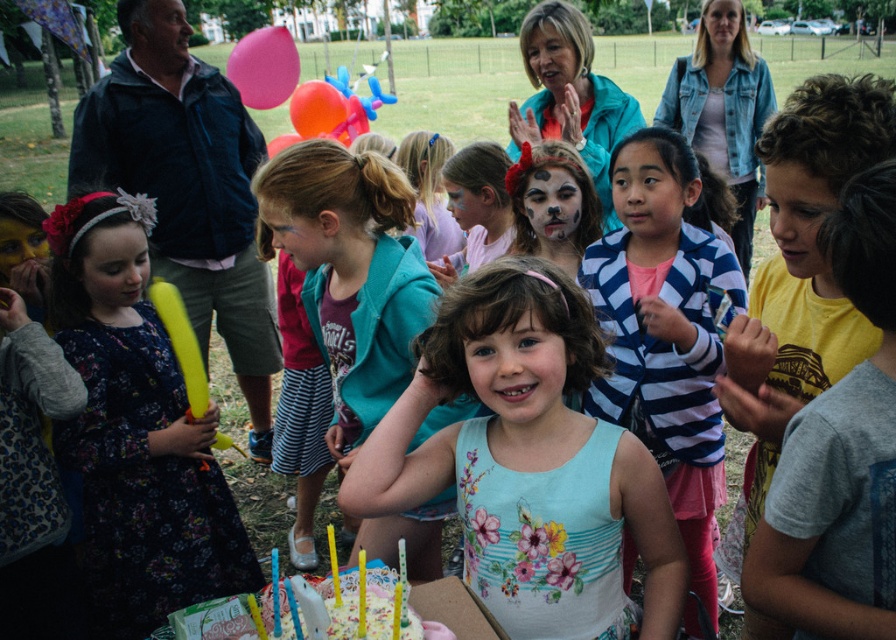
Question: Does striped cotton jacket at center appear on the right side of pink matte balloon at upper center?

Choices:
 (A) yes
 (B) no

Answer: (A)

Question: Considering the real-world distances, which object is closest to the pink rubber balloon at upper center?

Choices:
 (A) floral printed tank top at center
 (B) white frosted cake with candles at center
 (C) striped cotton jacket at center

Answer: (C)

Question: Can you confirm if teal hoodie at center is positioned to the right of pink matte balloon at upper center?

Choices:
 (A) no
 (B) yes

Answer: (B)

Question: Which point is closer to the camera?

Choices:
 (A) (678, 604)
 (B) (315, 113)
 (C) (366, 580)
 (D) (65, 426)

Answer: (C)

Question: Can you confirm if floral printed tank top at center is positioned to the left of striped cotton jacket at center?

Choices:
 (A) yes
 (B) no

Answer: (A)

Question: Among these objects, which one is farthest from the camera?

Choices:
 (A) striped cotton jacket at center
 (B) pink rubber balloon at upper center
 (C) white frosted cake with candles at center
 (D) rubber balloon at center

Answer: (D)